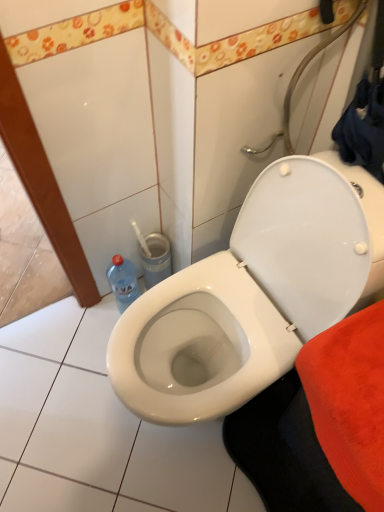
Measure the distance between white glossy toilet at center and camera.

They are 29.41 inches apart.

Describe the element at coordinates (253, 294) in the screenshot. I see `white glossy toilet at center` at that location.

The width and height of the screenshot is (384, 512). In order to click on white glossy toilet at center in this screenshot , I will do `click(253, 294)`.

Locate an element on the screen. The image size is (384, 512). white glossy toilet at center is located at coordinates (253, 294).